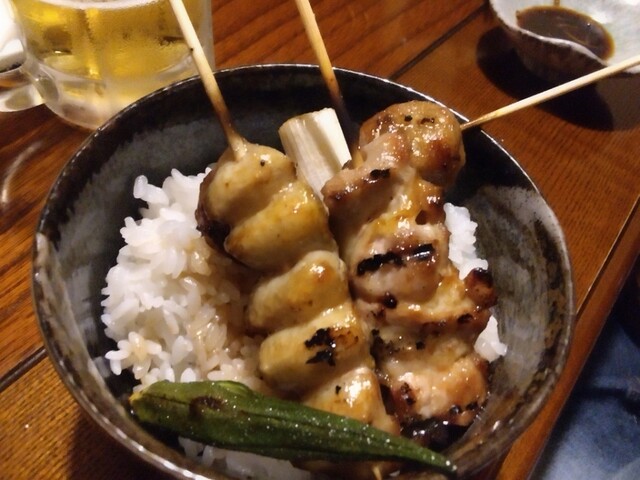
Identify the location of table. (15, 432).